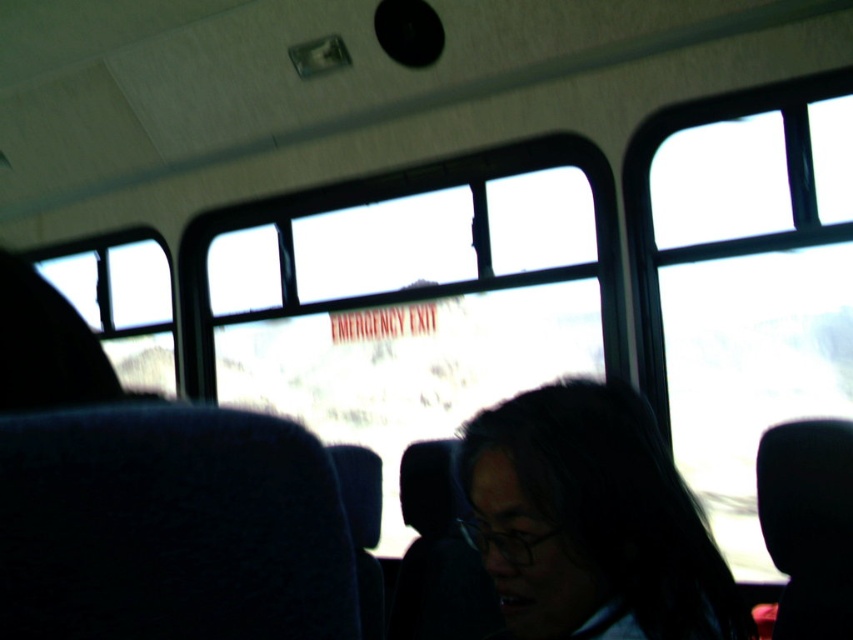
Who is more distant from viewer, (x=756, y=384) or (x=512, y=454)?

Positioned behind is point (x=756, y=384).

The height and width of the screenshot is (640, 853). Describe the element at coordinates (743, 280) in the screenshot. I see `transparent glass window at upper right` at that location.

The height and width of the screenshot is (640, 853). I want to click on transparent glass window at upper right, so click(x=743, y=280).

Who is shorter, transparent glass emergency exit sign at center or transparent glass window at left?

Standing shorter between the two is transparent glass window at left.

Find the location of a particular element. transparent glass emergency exit sign at center is located at coordinates (409, 294).

Can you confirm if transparent glass emergency exit sign at center is thinner than black matte hair at center?

No, transparent glass emergency exit sign at center is not thinner than black matte hair at center.

This screenshot has width=853, height=640. What are the coordinates of `transparent glass emergency exit sign at center` in the screenshot? It's located at click(409, 294).

Find the location of `transparent glass emergency exit sign at center`. transparent glass emergency exit sign at center is located at coordinates (409, 294).